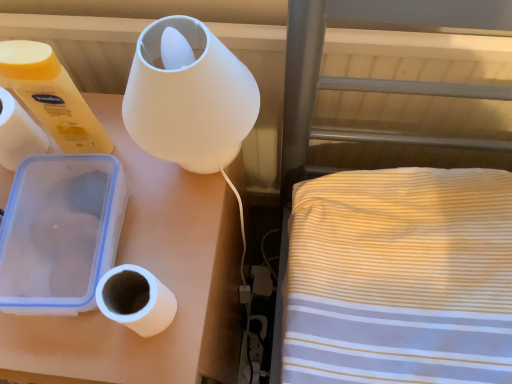
The image size is (512, 384). What are the coordinates of `vacant space that is to the left of white matte toilet paper at lower left, which is counted as the 2th toilet paper, starting from the left` in the screenshot? It's located at (59, 330).